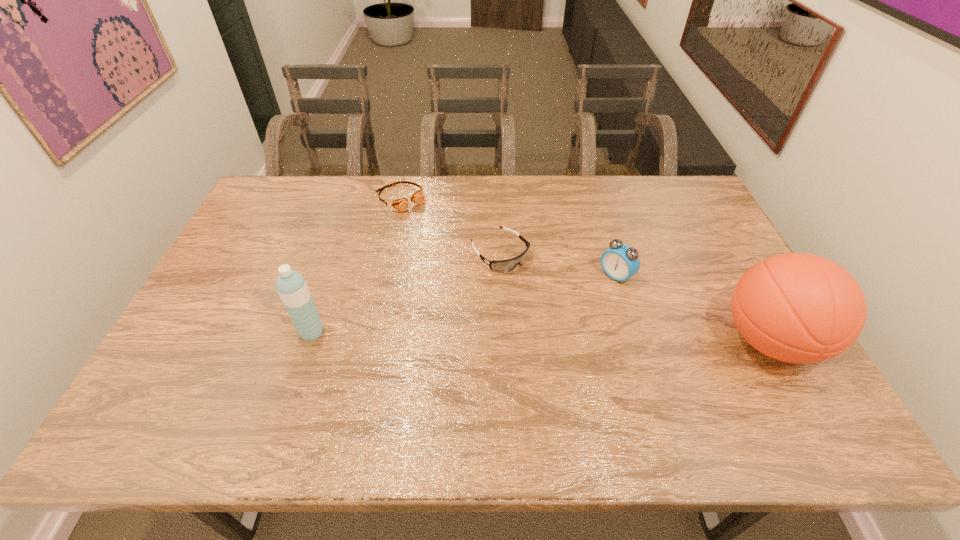
You are a GUI agent. You are given a task and a screenshot of the screen. Output one action in this format:
    pyautogui.click(x=<x>, y=<y>)
    Task: Click on the vacant spot on the desktop that is between the leftmost object and the rightmost object and is positioned on the front and sides of the third object from right to left
    Image resolution: width=960 pixels, height=540 pixels.
    Given the screenshot: What is the action you would take?
    pyautogui.click(x=590, y=338)

At what (x,y) coordinates should I click in order to perform the action: click on vacant spot on the desktop that is between the leftmost object and the rightmost object and is positioned on the face of the alarm clock. Please return your answer as a coordinate pair (x, y). Image resolution: width=960 pixels, height=540 pixels. Looking at the image, I should click on (543, 336).

This screenshot has width=960, height=540. Find the location of `vacant space on the desktop that is between the water bottle and the basketball and is positioned with the lenses facing forward on the left goggles`. vacant space on the desktop that is between the water bottle and the basketball and is positioned with the lenses facing forward on the left goggles is located at coordinates (546, 336).